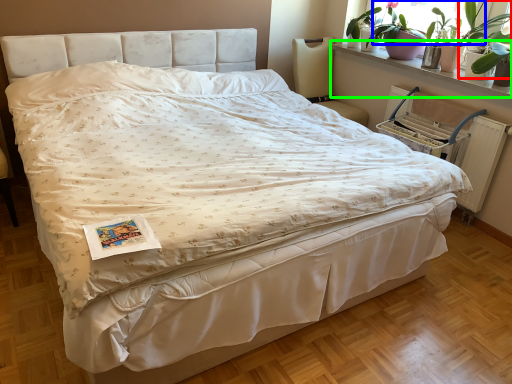
Question: Based on their relative distances, which object is farther from plant (highlighted by a red box)? Choose from window screen (highlighted by a blue box) and window sill (highlighted by a green box).

Choices:
 (A) window screen
 (B) window sill

Answer: (B)